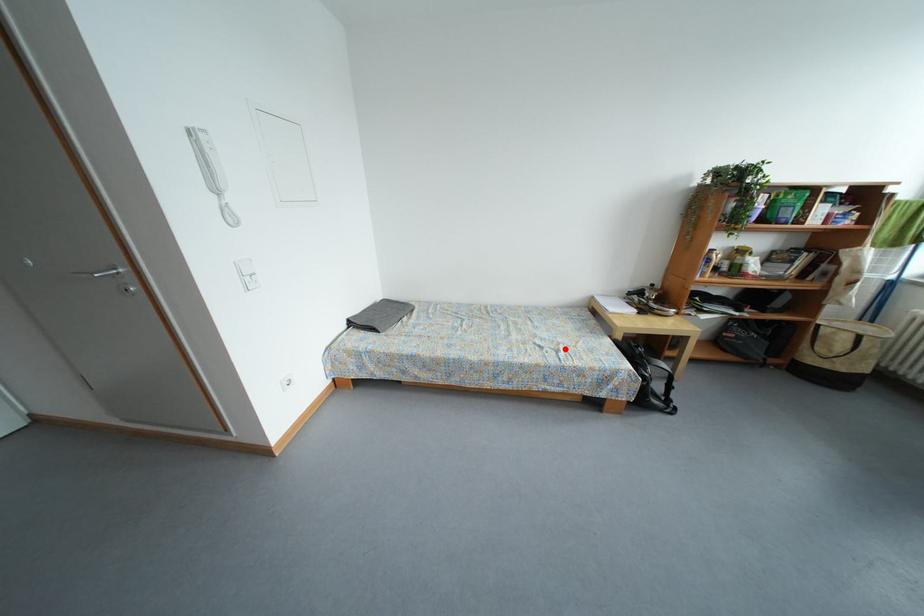
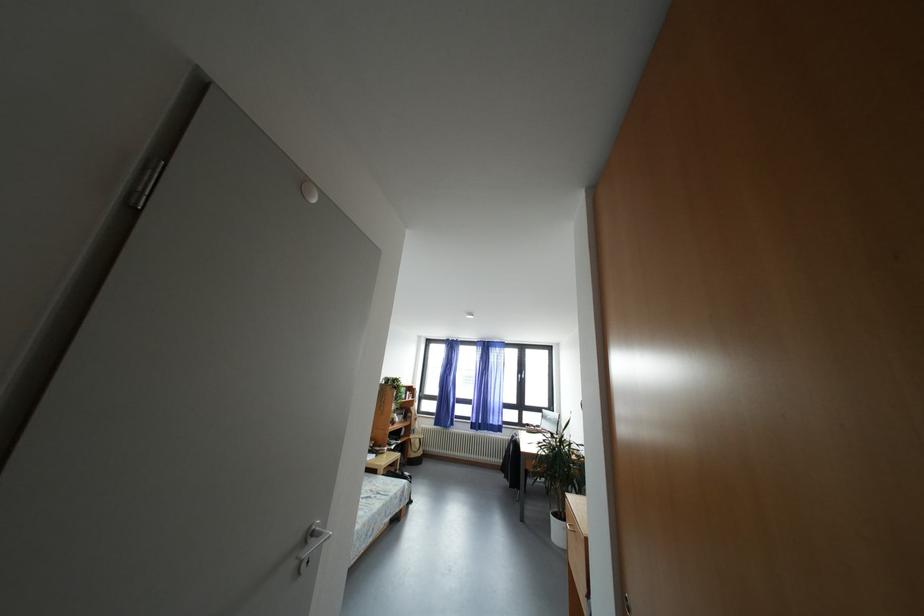
Question: I am providing you with two images of the same scene from different viewpoints. Given a red point in image1, look at the same physical point in image2. Is it:

Choices:
 (A) Closer to the viewpoint
 (B) Farther from the viewpoint

Answer: (A)